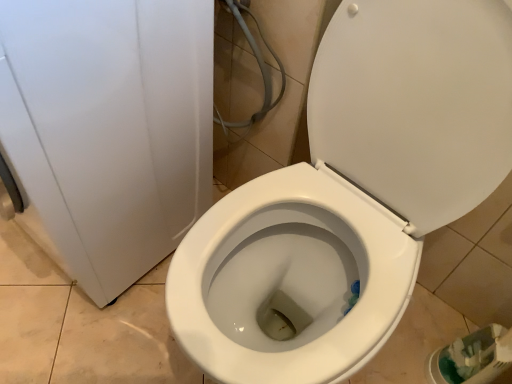
Question: Does white glossy toilet at center appear on the left side of white glossy toilet at center?

Choices:
 (A) yes
 (B) no

Answer: (B)

Question: From the image's perspective, is white glossy toilet at center located above white glossy toilet at center?

Choices:
 (A) yes
 (B) no

Answer: (B)

Question: Is white glossy toilet at center behind white glossy toilet at center?

Choices:
 (A) no
 (B) yes

Answer: (A)

Question: Can you confirm if white glossy toilet at center is taller than white glossy toilet at center?

Choices:
 (A) no
 (B) yes

Answer: (B)

Question: Does white glossy toilet at center have a greater width compared to white glossy toilet at center?

Choices:
 (A) no
 (B) yes

Answer: (B)

Question: Considering the relative sizes of white glossy toilet at center and white glossy toilet at center in the image provided, is white glossy toilet at center shorter than white glossy toilet at center?

Choices:
 (A) yes
 (B) no

Answer: (B)

Question: Is white glossy toilet at center not inside white glossy toilet at center?

Choices:
 (A) yes
 (B) no

Answer: (A)

Question: From a real-world perspective, is white glossy toilet at center positioned over white glossy toilet at center based on gravity?

Choices:
 (A) no
 (B) yes

Answer: (A)

Question: Is white glossy toilet at center further to camera compared to white glossy toilet at center?

Choices:
 (A) yes
 (B) no

Answer: (A)

Question: Is white glossy toilet at center far away from white glossy toilet at center?

Choices:
 (A) no
 (B) yes

Answer: (A)

Question: From a real-world perspective, is white glossy toilet at center located beneath white glossy toilet at center?

Choices:
 (A) no
 (B) yes

Answer: (B)

Question: From the image's perspective, is white glossy toilet at center above white glossy toilet at center?

Choices:
 (A) no
 (B) yes

Answer: (B)

Question: Is white glossy toilet at center taller or shorter than white glossy toilet at center?

Choices:
 (A) short
 (B) tall

Answer: (B)